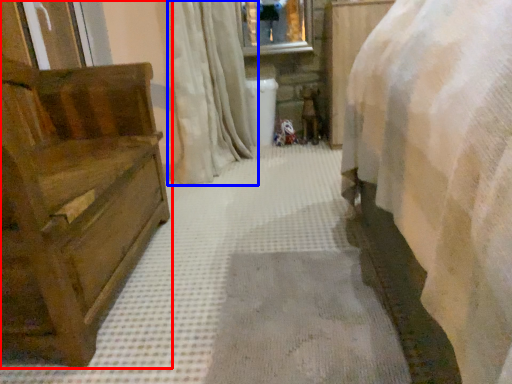
Question: Which of the following is the closest to the observer, furniture (highlighted by a red box) or curtain (highlighted by a blue box)?

Choices:
 (A) furniture
 (B) curtain

Answer: (A)